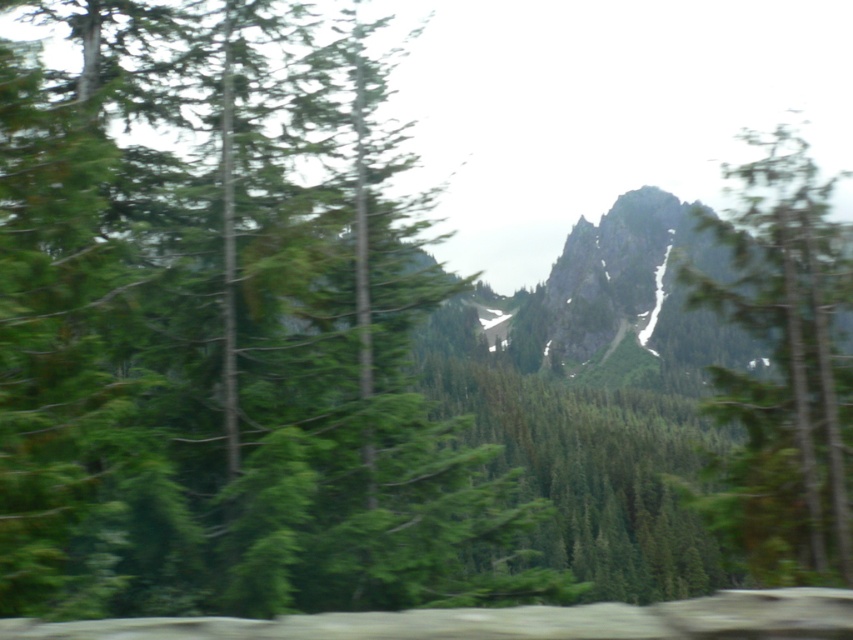
Question: Is green matte tree at center above rocky gray mountain at center?

Choices:
 (A) yes
 (B) no

Answer: (A)

Question: Which point appears closest to the camera in this image?

Choices:
 (A) (523, 358)
 (B) (198, 516)
 (C) (836, 534)

Answer: (C)

Question: Which of the following is the closest to the observer?

Choices:
 (A) green textured tree at right
 (B) green matte tree at center
 (C) rocky gray mountain at center

Answer: (B)

Question: Does green textured tree at right appear under rocky gray mountain at center?

Choices:
 (A) no
 (B) yes

Answer: (A)

Question: Which object appears farthest from the camera in this image?

Choices:
 (A) green textured tree at right
 (B) green matte tree at center
 (C) rocky gray mountain at center

Answer: (C)

Question: Is green matte tree at center to the right of green textured tree at right from the viewer's perspective?

Choices:
 (A) no
 (B) yes

Answer: (A)